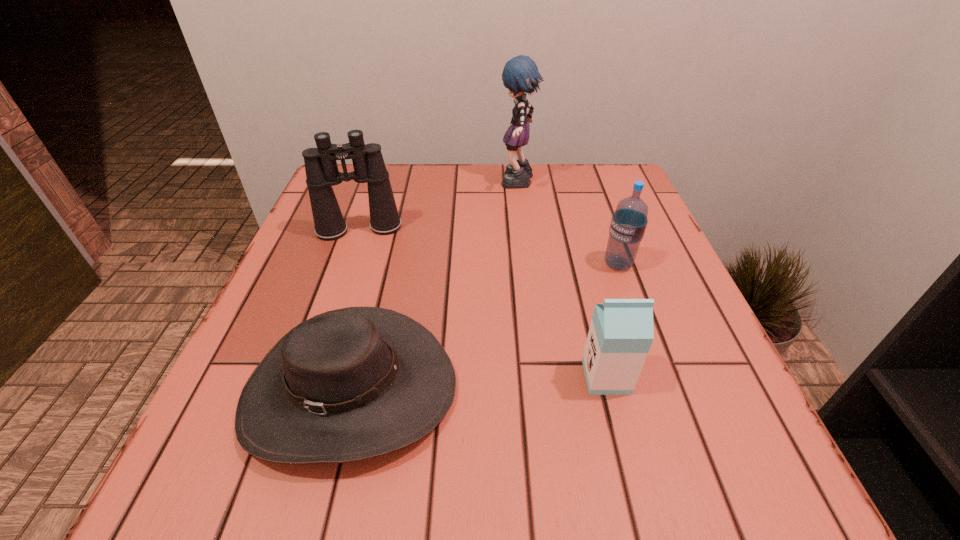
The image size is (960, 540). I want to click on blank area in the image that satisfies the following two spatial constraints: 1. on the front-facing side of the rag doll; 2. on the front-facing side of the cowboy hat, so click(x=543, y=390).

Where is `free space in the image that satisfies the following two spatial constraints: 1. on the front side of the second farthest object; 2. on the right side of the fourth object from left to right`? The image size is (960, 540). free space in the image that satisfies the following two spatial constraints: 1. on the front side of the second farthest object; 2. on the right side of the fourth object from left to right is located at coordinates (308, 377).

Where is `vacant space that satisfies the following two spatial constraints: 1. on the front-facing side of the tallest object; 2. on the right side of the fourth object from left to right`? The width and height of the screenshot is (960, 540). vacant space that satisfies the following two spatial constraints: 1. on the front-facing side of the tallest object; 2. on the right side of the fourth object from left to right is located at coordinates (541, 377).

Where is `vacant space that satisfies the following two spatial constraints: 1. on the front side of the second farthest object; 2. on the left side of the milk carton`? Image resolution: width=960 pixels, height=540 pixels. vacant space that satisfies the following two spatial constraints: 1. on the front side of the second farthest object; 2. on the left side of the milk carton is located at coordinates (308, 377).

I want to click on free space that satisfies the following two spatial constraints: 1. on the back side of the rightmost object; 2. on the right side of the milk carton, so click(578, 264).

Find the location of a particular element. Image resolution: width=960 pixels, height=540 pixels. vacant region that satisfies the following two spatial constraints: 1. on the front-facing side of the rag doll; 2. on the front-facing side of the cowboy hat is located at coordinates (543, 390).